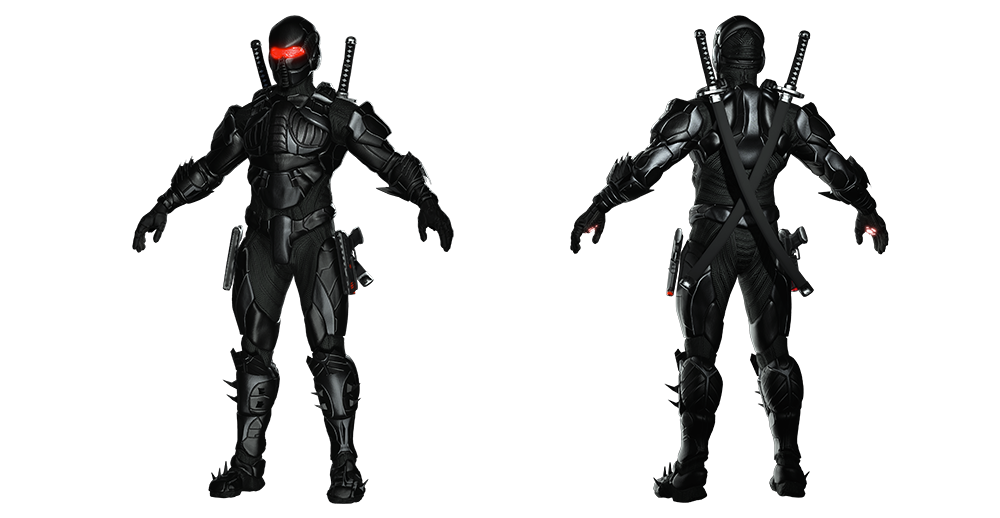
Locate an element on the screen. The image size is (1000, 518). handles is located at coordinates (799, 74).